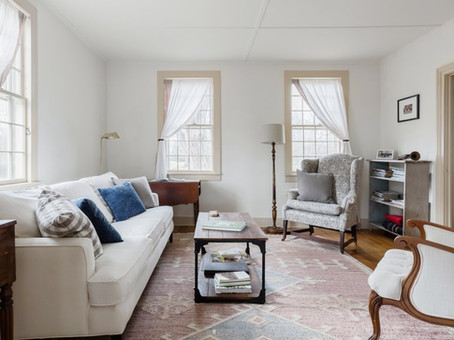
This screenshot has width=454, height=340. In order to click on off white couch in this screenshot , I will do `click(137, 226)`.